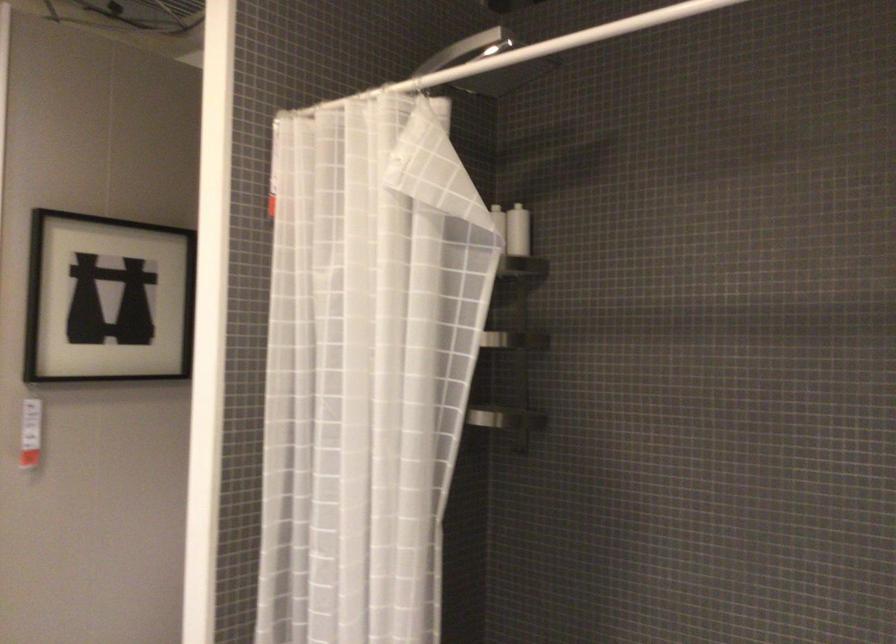
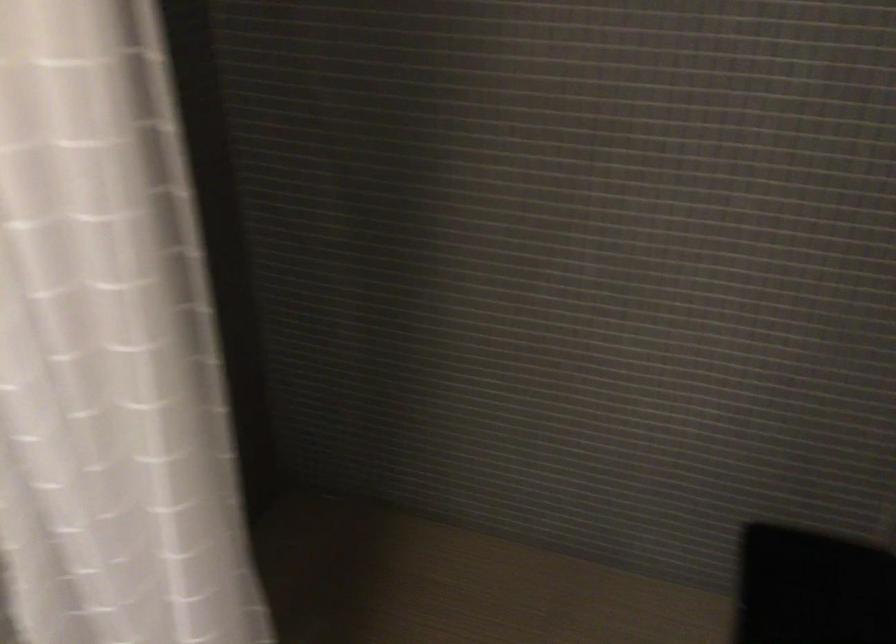
The first image is from the beginning of the video and the second image is from the end. How did the camera likely rotate when shooting the video?

The camera rotated toward right-down.